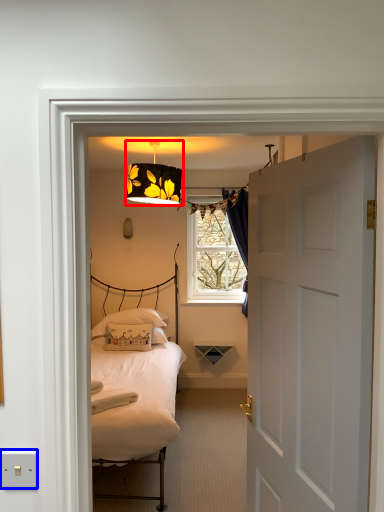
Question: Among these objects, which one is farthest to the camera, lamp (highlighted by a red box) or electric outlet (highlighted by a blue box)?

Choices:
 (A) lamp
 (B) electric outlet

Answer: (A)